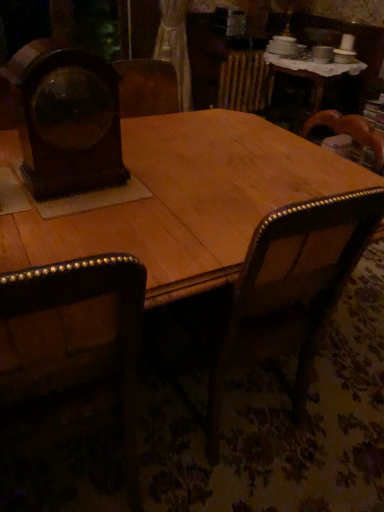
Question: Does wooden armchair at center have a lesser width compared to dark brown leather chair at left?

Choices:
 (A) no
 (B) yes

Answer: (B)

Question: Are wooden armchair at center and dark brown leather chair at left making contact?

Choices:
 (A) no
 (B) yes

Answer: (A)

Question: From a real-world perspective, is wooden armchair at center positioned under dark brown leather chair at left based on gravity?

Choices:
 (A) no
 (B) yes

Answer: (B)

Question: Considering the relative sizes of wooden armchair at center and dark brown leather chair at left in the image provided, is wooden armchair at center shorter than dark brown leather chair at left?

Choices:
 (A) yes
 (B) no

Answer: (A)

Question: Is wooden armchair at center at the left side of dark brown leather chair at left?

Choices:
 (A) no
 (B) yes

Answer: (A)

Question: From a real-world perspective, is dark brown leather chair at left positioned above or below wooden armchair at center?

Choices:
 (A) below
 (B) above

Answer: (B)

Question: Does point (127, 461) appear closer or farther from the camera than point (317, 330)?

Choices:
 (A) closer
 (B) farther

Answer: (A)

Question: In the image, is dark brown leather chair at left on the left side or the right side of wooden armchair at center?

Choices:
 (A) right
 (B) left

Answer: (B)

Question: From the image's perspective, is dark brown leather chair at left positioned above or below wooden armchair at center?

Choices:
 (A) below
 (B) above

Answer: (A)

Question: From the image's perspective, is dark brown leather chair at left positioned above or below wooden clock at left?

Choices:
 (A) below
 (B) above

Answer: (A)

Question: Is dark brown leather chair at left to the left or to the right of wooden clock at left in the image?

Choices:
 (A) left
 (B) right

Answer: (A)

Question: From their relative heights in the image, would you say dark brown leather chair at left is taller or shorter than wooden clock at left?

Choices:
 (A) tall
 (B) short

Answer: (A)

Question: In terms of size, does dark brown leather chair at left appear bigger or smaller than wooden clock at left?

Choices:
 (A) small
 (B) big

Answer: (B)

Question: In terms of width, does wooden armchair at center look wider or thinner when compared to dark brown leather chair at left?

Choices:
 (A) thin
 (B) wide

Answer: (A)

Question: From a real-world perspective, is wooden armchair at center positioned above or below dark brown leather chair at left?

Choices:
 (A) below
 (B) above

Answer: (A)